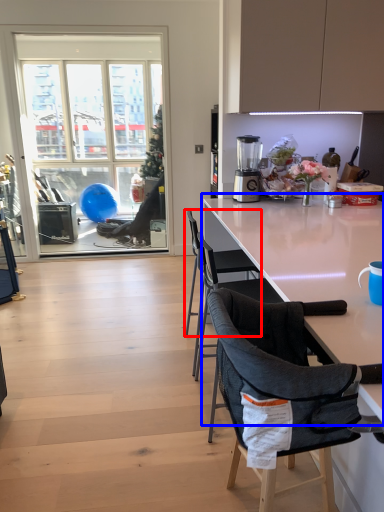
Question: Among these objects, which one is nearest to the camera, chair (highlighted by a red box) or kitchen & dining room table (highlighted by a blue box)?

Choices:
 (A) chair
 (B) kitchen & dining room table

Answer: (B)